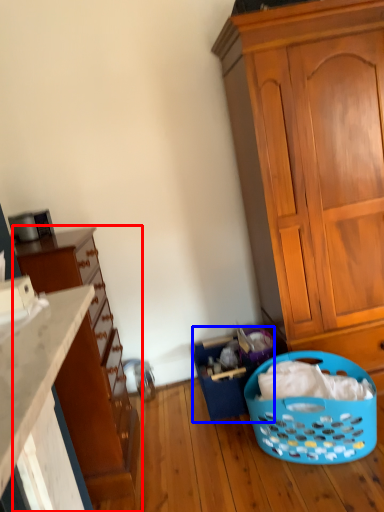
Question: Which object appears closest to the camera in this image, cupboard (highlighted by a red box) or basket (highlighted by a blue box)?

Choices:
 (A) cupboard
 (B) basket

Answer: (A)